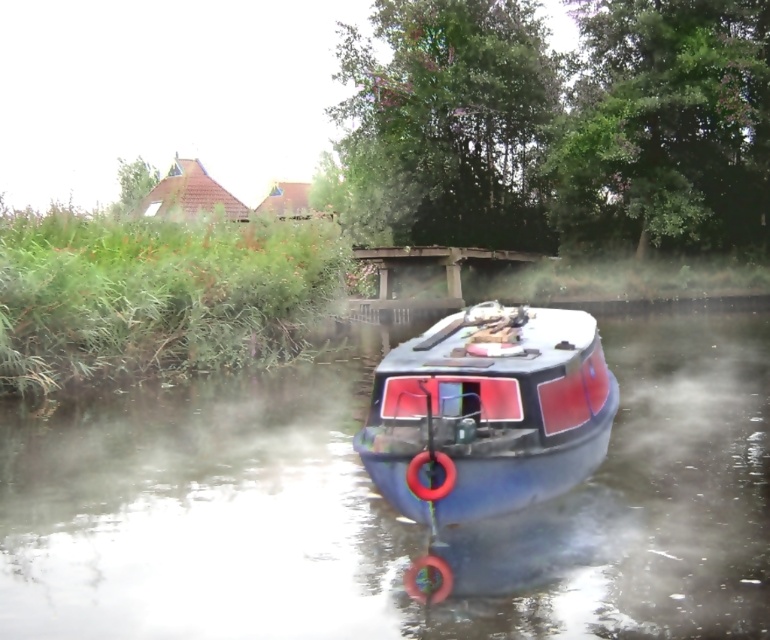
Does blue rubber boat at center appear under blue matte boat at center?

Yes.

Between point (273, 388) and point (544, 465), which one is positioned in front?

Point (544, 465)

Is point (470, 602) farther from viewer compared to point (437, 429)?

No, it is not.

At what (x,y) coordinates should I click in order to perform the action: click on blue rubber boat at center. Please return your answer as a coordinate pair (x, y). The image size is (770, 640). Looking at the image, I should click on (387, 508).